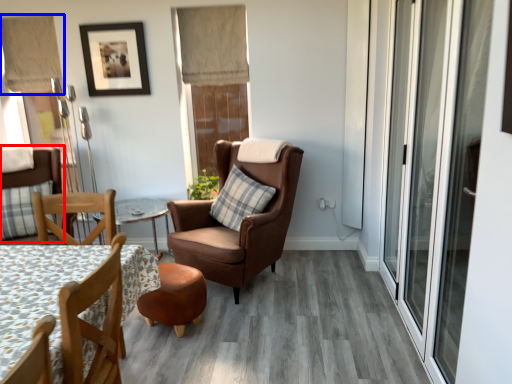
Question: Which point is closer to the camera, chair (highlighted by a red box) or curtain (highlighted by a blue box)?

Choices:
 (A) chair
 (B) curtain

Answer: (A)